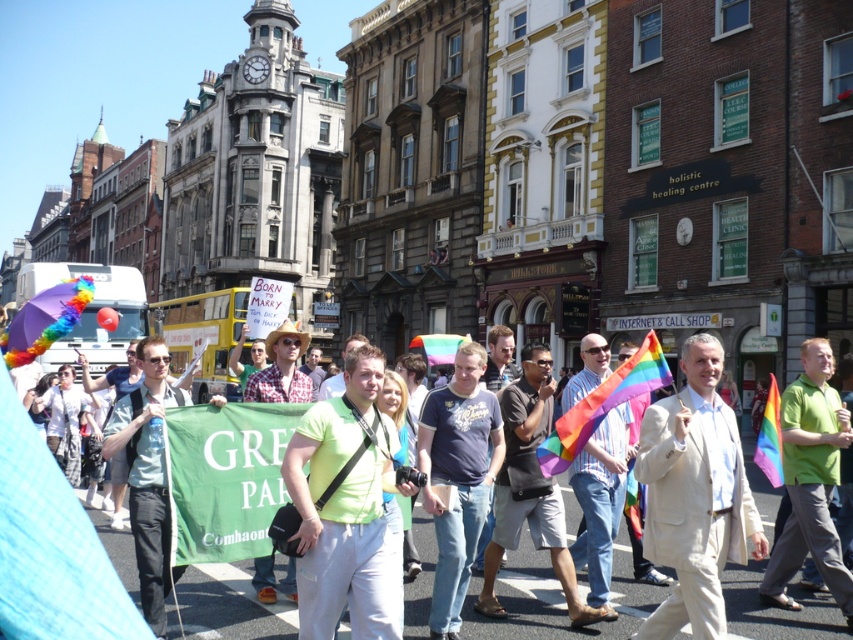
You are a photographer at the event and want to capture both the white textured suit at center and the green matte shirt at center in a single frame. Which clothing item is narrower and would allow for a tighter crop without cutting off the other?

The white textured suit at center is thinner than the green matte shirt at center, so it would allow for a tighter crop without cutting off the other.

Consider the image. You are a photographer at the event and want to capture a photo of the white textured suit at center. What are the coordinates to focus on?

The white textured suit at center is located at coordinates point [695,496].